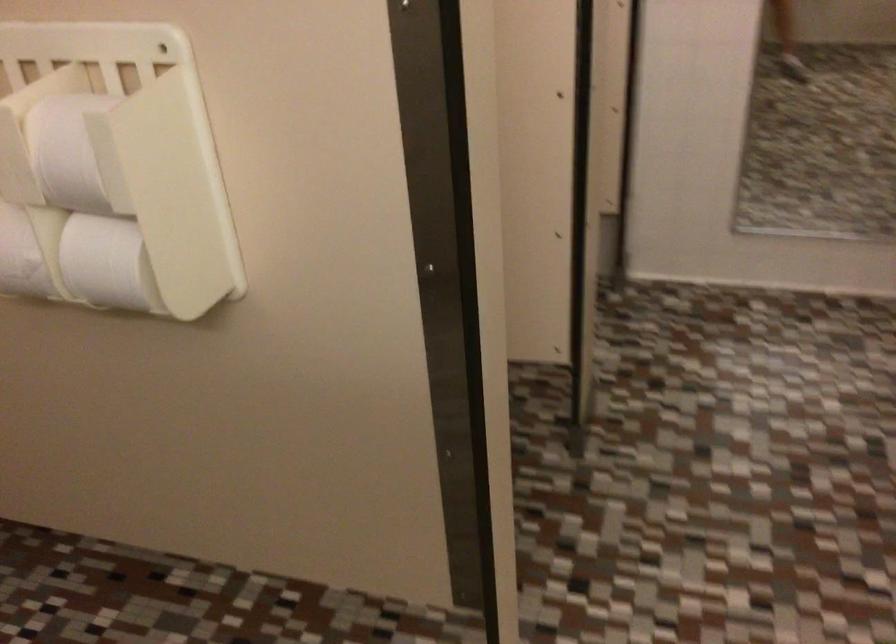
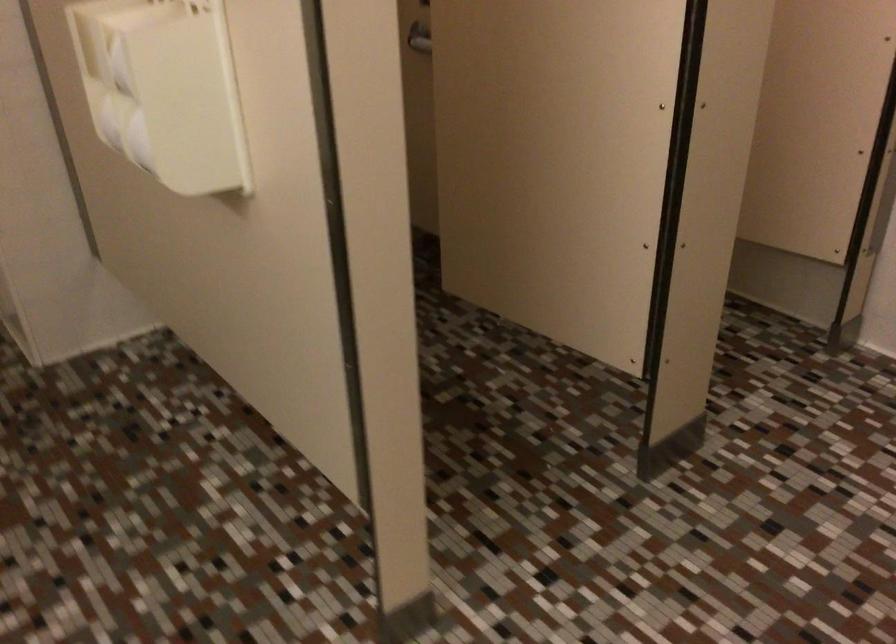
Question: Based on the continuous images, in which direction is the camera rotating? Reply with the corresponding letter.

Choices:
 (A) Left
 (B) Right
 (C) Up
 (D) Down

Answer: (A)